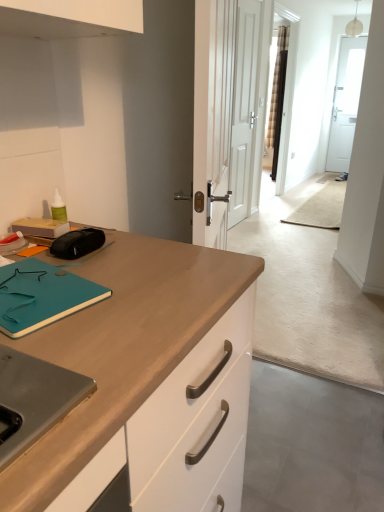
Question: Can you confirm if white matte door at center is wider than teal matte notepad at left?

Choices:
 (A) no
 (B) yes

Answer: (A)

Question: Is white matte door at center not near teal matte notepad at left?

Choices:
 (A) yes
 (B) no

Answer: (A)

Question: Is white matte door at center not inside teal matte notepad at left?

Choices:
 (A) no
 (B) yes

Answer: (B)

Question: Considering the relative sizes of white matte door at center and teal matte notepad at left in the image provided, is white matte door at center shorter than teal matte notepad at left?

Choices:
 (A) yes
 (B) no

Answer: (B)

Question: Is white matte door at center to the left of teal matte notepad at left from the viewer's perspective?

Choices:
 (A) no
 (B) yes

Answer: (A)

Question: Considering the relative sizes of white matte door at center and teal matte notepad at left in the image provided, is white matte door at center bigger than teal matte notepad at left?

Choices:
 (A) yes
 (B) no

Answer: (A)

Question: Does teal matte notepad at left have a smaller size compared to white matte door at center?

Choices:
 (A) yes
 (B) no

Answer: (A)

Question: Can you confirm if teal matte notepad at left is taller than white matte door at center?

Choices:
 (A) yes
 (B) no

Answer: (B)

Question: Can you confirm if teal matte notepad at left is thinner than white matte door at center?

Choices:
 (A) yes
 (B) no

Answer: (B)

Question: Is teal matte notepad at left facing away from white matte door at center?

Choices:
 (A) no
 (B) yes

Answer: (A)

Question: Is teal matte notepad at left touching white matte door at center?

Choices:
 (A) yes
 (B) no

Answer: (B)

Question: From a real-world perspective, does teal matte notepad at left stand above white matte door at center?

Choices:
 (A) yes
 (B) no

Answer: (B)

Question: In the image, is white matte door at center positioned in front of or behind teal matte notepad at left?

Choices:
 (A) behind
 (B) front

Answer: (A)